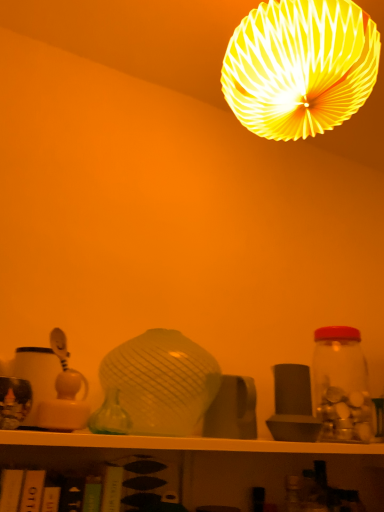
Question: From a real-world perspective, is yellow paper lampshade at upper center located beneath matte yellow plastic toy at left?

Choices:
 (A) no
 (B) yes

Answer: (A)

Question: Is yellow paper lampshade at upper center beside matte yellow plastic toy at left?

Choices:
 (A) yes
 (B) no

Answer: (B)

Question: Is the position of yellow paper lampshade at upper center more distant than that of matte yellow plastic toy at left?

Choices:
 (A) no
 (B) yes

Answer: (A)

Question: Is yellow paper lampshade at upper center shorter than matte yellow plastic toy at left?

Choices:
 (A) yes
 (B) no

Answer: (B)

Question: Can you confirm if yellow paper lampshade at upper center is wider than matte yellow plastic toy at left?

Choices:
 (A) no
 (B) yes

Answer: (B)

Question: Looking at their shapes, would you say yellow paper lampshade at upper center is wider or thinner than matte yellow plastic toy at left?

Choices:
 (A) thin
 (B) wide

Answer: (B)

Question: Considering the relative positions of yellow paper lampshade at upper center and matte yellow plastic toy at left in the image provided, is yellow paper lampshade at upper center to the left or to the right of matte yellow plastic toy at left?

Choices:
 (A) left
 (B) right

Answer: (B)

Question: From their relative heights in the image, would you say yellow paper lampshade at upper center is taller or shorter than matte yellow plastic toy at left?

Choices:
 (A) short
 (B) tall

Answer: (B)

Question: In terms of size, does yellow paper lampshade at upper center appear bigger or smaller than matte yellow plastic toy at left?

Choices:
 (A) big
 (B) small

Answer: (A)

Question: From a real-world perspective, relative to transparent glass jar at right, is yellow paper lampshade at upper center vertically above or below?

Choices:
 (A) above
 (B) below

Answer: (A)

Question: Considering their positions, is yellow paper lampshade at upper center located in front of or behind transparent glass jar at right?

Choices:
 (A) front
 (B) behind

Answer: (A)

Question: Is yellow paper lampshade at upper center spatially inside transparent glass jar at right, or outside of it?

Choices:
 (A) inside
 (B) outside

Answer: (B)

Question: In terms of width, does yellow paper lampshade at upper center look wider or thinner when compared to transparent glass jar at right?

Choices:
 (A) thin
 (B) wide

Answer: (B)

Question: From the image's perspective, relative to transparent glass jar at right, is green glass vase at center above or below?

Choices:
 (A) above
 (B) below

Answer: (A)

Question: Considering the positions of green glass vase at center and transparent glass jar at right in the image, is green glass vase at center bigger or smaller than transparent glass jar at right?

Choices:
 (A) small
 (B) big

Answer: (A)